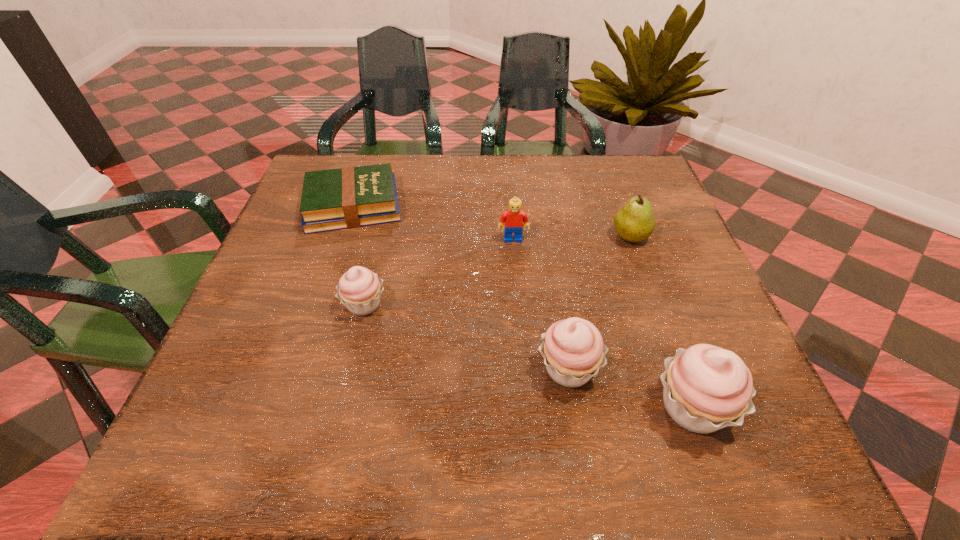
Locate an element on the screen. The image size is (960, 540). free spot that satisfies the following two spatial constraints: 1. on the front side of the second cupcake from right to left; 2. on the right side of the book is located at coordinates (300, 368).

Find the location of a particular element. Image resolution: width=960 pixels, height=540 pixels. free space that satisfies the following two spatial constraints: 1. on the front side of the second cupcake from right to left; 2. on the right side of the book is located at coordinates (300, 368).